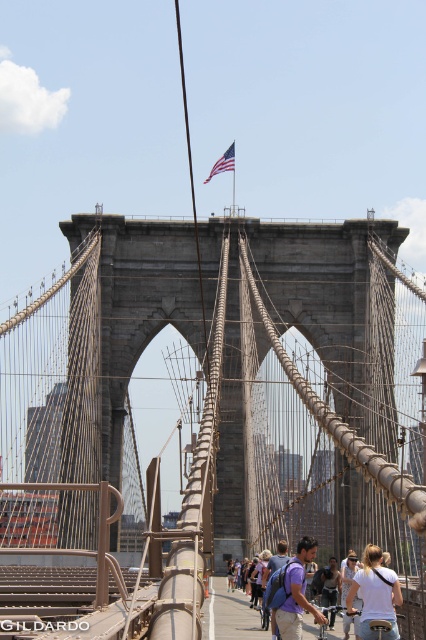
You are standing on the Brooklyn Bridge and see a person wearing a white cotton shirt at lower right. If you want to wave to them, will your gesture be visible to them? Explain your reasoning based on the distance provided.

The white cotton shirt at lower right is 151.25 meters away from the viewer. While this distance is quite far, the clear sky and bright sunlight would allow visibility of a large, deliberate gesture like waving. However, the person might not be able to see small details or recognize your face clearly.

You are standing on the Brooklyn Bridge and see a white cotton shirt at lower right and a matte purple backpack at center. Which object is positioned more to the right side of the scene?

The white cotton shirt at lower right is positioned to the right of the matte purple backpack at center, so it is more to the right side of the scene.